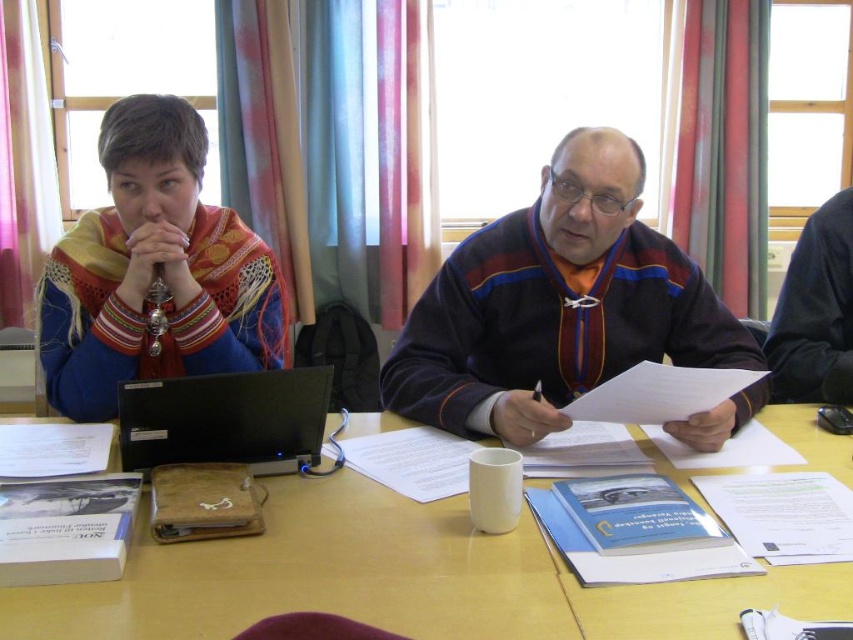
Between matte black sweater at center and matte multicolored scarf at left, which one has less height?

With less height is matte black sweater at center.

Is point (647, 305) behind point (154, 188)?

Yes.

Identify the location of matte black sweater at center. The image size is (853, 640). (556, 305).

Is matte black sweater at center thinner than black glossy laptop at center?

Incorrect, matte black sweater at center's width is not less than black glossy laptop at center's.

Is matte black sweater at center positioned before black glossy laptop at center?

No.

Between point (397, 358) and point (300, 378), which one is positioned behind?

Positioned behind is point (397, 358).

What are the coordinates of `matte black sweater at center` in the screenshot? It's located at (556, 305).

Locate an element on the screen. black glossy laptop at center is located at coordinates click(x=225, y=419).

Who is more forward, (123,445) or (670,396)?

Point (123,445) is more forward.

Does point (167, 424) lie behind point (698, 371)?

That is False.

Identify the location of black glossy laptop at center. The image size is (853, 640). (225, 419).